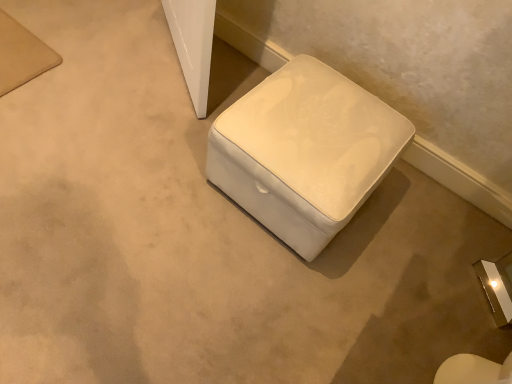
In order to click on white leather ottoman at center in this screenshot , I will do pos(305,152).

The image size is (512, 384). Describe the element at coordinates (305, 152) in the screenshot. I see `white leather ottoman at center` at that location.

In order to click on white leather ottoman at center in this screenshot , I will do `click(305, 152)`.